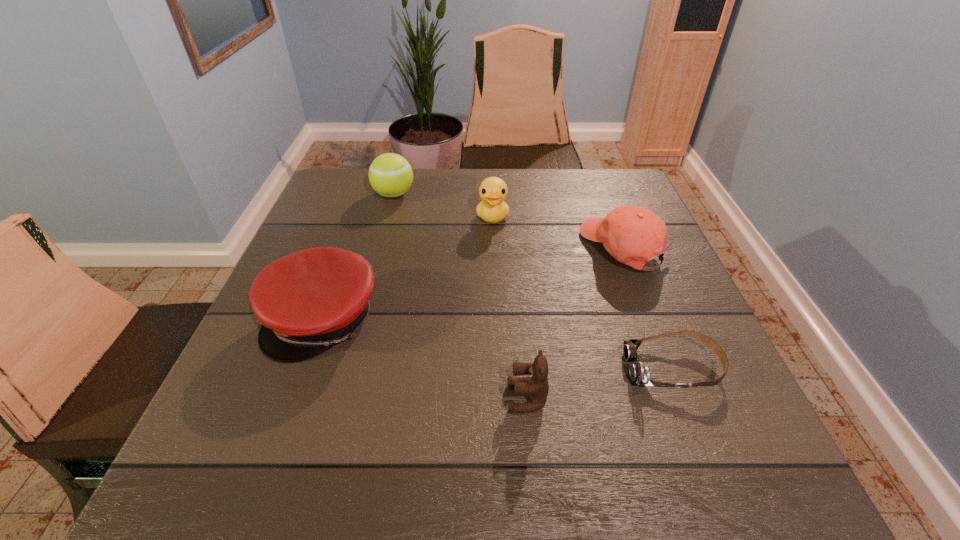
The width and height of the screenshot is (960, 540). What are the coordinates of `tennis ball` in the screenshot? It's located at (390, 175).

This screenshot has width=960, height=540. What are the coordinates of `duck` in the screenshot? It's located at (492, 209).

Locate an element on the screen. This screenshot has height=540, width=960. baseball cap is located at coordinates (632, 235).

The height and width of the screenshot is (540, 960). I want to click on cap, so click(308, 301).

You are a GUI agent. You are given a task and a screenshot of the screen. Output one action in this format:
    pyautogui.click(x=<x>, y=<y>)
    Task: Click on the teddy bear
    
    Given the screenshot: What is the action you would take?
    pyautogui.click(x=537, y=387)

Locate an element on the screen. Image resolution: width=960 pixels, height=540 pixels. goggles is located at coordinates (639, 374).

The image size is (960, 540). What are the coordinates of `vacant space situated 0.080m on the right of the tennis ball` in the screenshot? It's located at (444, 194).

Find the location of `free space located on the face of the duck`. free space located on the face of the duck is located at coordinates (497, 346).

Identify the location of free space located 0.190m on the front of the baseball cap. The image size is (960, 540). (661, 347).

I want to click on free space located 0.190m at the front of the cap where the visor is located, so click(271, 468).